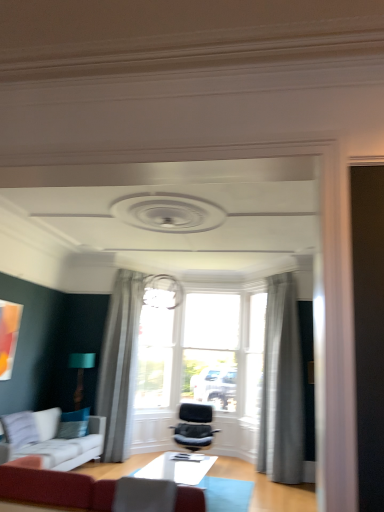
This screenshot has height=512, width=384. I want to click on velvet red sofa at lower left, the second studio couch from the left, so click(56, 489).

What is the approximate width of sheer gray curtain at upper center, the 2th curtain when ordered from left to right?

17.19 inches.

How much space does sheer gray curtain at upper center, arranged as the 1th curtain when viewed from the right, occupy vertically?

The height of sheer gray curtain at upper center, arranged as the 1th curtain when viewed from the right, is 9.73 feet.

Image resolution: width=384 pixels, height=512 pixels. Describe the element at coordinates (178, 468) in the screenshot. I see `white glossy table at center` at that location.

I want to click on gray sheer curtain at center, marked as the 1th curtain in a left-to-right arrangement, so click(x=120, y=364).

Identify the location of velvet red sofa at lower left, the second studio couch from the left. This screenshot has height=512, width=384. (56, 489).

Looking at this image, is teal fabric pillow at lower left shorter than velvet red sofa at lower left, the second studio couch from the left?

Correct, teal fabric pillow at lower left is not as tall as velvet red sofa at lower left, the second studio couch from the left.

From the image's perspective, which is above, teal fabric pillow at lower left or velvet red sofa at lower left, marked as the 1th studio couch in a right-to-left arrangement?

velvet red sofa at lower left, marked as the 1th studio couch in a right-to-left arrangement, is shown above in the image.

Can velvet red sofa at lower left, the second studio couch from the left, be found inside teal fabric pillow at lower left?

No, velvet red sofa at lower left, the second studio couch from the left, is located outside of teal fabric pillow at lower left.

Does teal fabric pillow at lower left lie in front of velvet red sofa at lower left, the second studio couch from the left?

No, it is behind velvet red sofa at lower left, the second studio couch from the left.

Would you say teal fabric pillow at lower left is part of gray sheer curtain at center, arranged as the 2th curtain when viewed from the right,'s contents?

No, teal fabric pillow at lower left is located outside of gray sheer curtain at center, arranged as the 2th curtain when viewed from the right.

From a real-world perspective, is gray sheer curtain at center, marked as the 1th curtain in a left-to-right arrangement, positioned above or below teal fabric pillow at lower left?

gray sheer curtain at center, marked as the 1th curtain in a left-to-right arrangement, is situated higher than teal fabric pillow at lower left in the real world.

Can velvet black chair at center be found inside white fabric couch at lower left, the second studio couch from the right?

No, white fabric couch at lower left, the second studio couch from the right, does not contain velvet black chair at center.

Is white fabric couch at lower left, the first studio couch in the back-to-front sequence, wider or thinner than velvet black chair at center?

Clearly, white fabric couch at lower left, the first studio couch in the back-to-front sequence, has less width compared to velvet black chair at center.

At what (x,y) coordinates should I click in order to perform the action: click on chair on the right of white fabric couch at lower left, marked as the 2th studio couch in a front-to-back arrangement. Please return your answer as a coordinate pair (x, y). The height and width of the screenshot is (512, 384). Looking at the image, I should click on (194, 426).

Is white fabric couch at lower left, the first studio couch in the back-to-front sequence, at the back of sheer gray curtain at upper center, the 2th curtain when ordered from left to right?

sheer gray curtain at upper center, the 2th curtain when ordered from left to right, is not turned away from white fabric couch at lower left, the first studio couch in the back-to-front sequence.

How different are the orientations of sheer gray curtain at upper center, the 2th curtain when ordered from left to right, and white fabric couch at lower left, the second studio couch from the right, in degrees?

The angular difference between sheer gray curtain at upper center, the 2th curtain when ordered from left to right, and white fabric couch at lower left, the second studio couch from the right, is 135 degrees.

Considering the sizes of sheer gray curtain at upper center, arranged as the 1th curtain when viewed from the right, and white fabric couch at lower left, the first studio couch in the back-to-front sequence, in the image, is sheer gray curtain at upper center, arranged as the 1th curtain when viewed from the right, bigger or smaller than white fabric couch at lower left, the first studio couch in the back-to-front sequence,?

sheer gray curtain at upper center, arranged as the 1th curtain when viewed from the right, is smaller than white fabric couch at lower left, the first studio couch in the back-to-front sequence.

How far apart are sheer gray curtain at upper center, the 2th curtain when ordered from left to right, and white fabric couch at lower left, marked as the 2th studio couch in a front-to-back arrangement?

sheer gray curtain at upper center, the 2th curtain when ordered from left to right, is 2.47 meters from white fabric couch at lower left, marked as the 2th studio couch in a front-to-back arrangement.

Is sheer gray curtain at upper center, the 2th curtain when ordered from left to right, directly adjacent to velvet red sofa at lower left, the second studio couch from the left?

They are not placed beside each other.

Is sheer gray curtain at upper center, arranged as the 1th curtain when viewed from the right, completely or partially outside of velvet red sofa at lower left, the second studio couch from the left?

Absolutely, sheer gray curtain at upper center, arranged as the 1th curtain when viewed from the right, is external to velvet red sofa at lower left, the second studio couch from the left.

Based on the photo, who is smaller, sheer gray curtain at upper center, the 2th curtain when ordered from left to right, or velvet red sofa at lower left, the second studio couch from the left?

velvet red sofa at lower left, the second studio couch from the left, is smaller.

Locate an element on the screen. The image size is (384, 512). pillow that is above the velvet black chair at center (from a real-world perspective) is located at coordinates (73, 424).

Would you say velvet black chair at center is outside teal fabric pillow at lower left?

velvet black chair at center lies outside teal fabric pillow at lower left's area.

Which of these two, velvet black chair at center or teal fabric pillow at lower left, is wider?

velvet black chair at center.

From a real-world perspective, which object rests below the other?

velvet black chair at center is physically lower.

Considering the relative sizes of gray sheer curtain at center, marked as the 1th curtain in a left-to-right arrangement, and sheer gray curtain at upper center, the 2th curtain when ordered from left to right, in the image provided, is gray sheer curtain at center, marked as the 1th curtain in a left-to-right arrangement, wider than sheer gray curtain at upper center, the 2th curtain when ordered from left to right,?

Correct, the width of gray sheer curtain at center, marked as the 1th curtain in a left-to-right arrangement, exceeds that of sheer gray curtain at upper center, the 2th curtain when ordered from left to right.

From the image's perspective, between gray sheer curtain at center, arranged as the 2th curtain when viewed from the right, and sheer gray curtain at upper center, the 2th curtain when ordered from left to right, who is located below?

sheer gray curtain at upper center, the 2th curtain when ordered from left to right, appears lower in the image.

Does gray sheer curtain at center, arranged as the 2th curtain when viewed from the right, have a greater height compared to sheer gray curtain at upper center, the 2th curtain when ordered from left to right?

Incorrect, the height of gray sheer curtain at center, arranged as the 2th curtain when viewed from the right, is not larger of that of sheer gray curtain at upper center, the 2th curtain when ordered from left to right.

Locate an element on the screen. studio couch located on the right of teal fabric pillow at lower left is located at coordinates (56, 489).

From the image's perspective, count 2nd curtains upward from the teal fabric pillow at lower left and point to it. Please provide its 2D coordinates.

[(120, 364)]

From the image, which object appears to be nearer to gray sheer curtain at center, marked as the 1th curtain in a left-to-right arrangement, white fabric couch at lower left, the first studio couch in the back-to-front sequence, or sheer gray curtain at upper center, the 2th curtain when ordered from left to right?

white fabric couch at lower left, the first studio couch in the back-to-front sequence.

From the image, which object appears to be farther from gray sheer curtain at center, arranged as the 2th curtain when viewed from the right, velvet red sofa at lower left, arranged as the 1th studio couch when viewed from the front, or sheer gray curtain at upper center, the 2th curtain when ordered from left to right?

velvet red sofa at lower left, arranged as the 1th studio couch when viewed from the front.

Based on the photo, from the image, which object appears to be nearer to sheer gray curtain at upper center, arranged as the 1th curtain when viewed from the right, gray sheer curtain at center, marked as the 1th curtain in a left-to-right arrangement, or white glossy table at center?

white glossy table at center is positioned closer to the anchor sheer gray curtain at upper center, arranged as the 1th curtain when viewed from the right.

Estimate the real-world distances between objects in this image. Which object is further from teal fabric lampshade at lower left, velvet black chair at center or gray sheer curtain at center, marked as the 1th curtain in a left-to-right arrangement?

Based on the image, velvet black chair at center appears to be further to teal fabric lampshade at lower left.

From the image, which object appears to be farther from velvet black chair at center, gray sheer curtain at center, marked as the 1th curtain in a left-to-right arrangement, or white glossy table at center?

gray sheer curtain at center, marked as the 1th curtain in a left-to-right arrangement, is further to velvet black chair at center.

Which object lies nearer to the anchor point teal fabric pillow at lower left, velvet red sofa at lower left, the second studio couch from the left, or white fabric couch at lower left, marked as the 2th studio couch in a front-to-back arrangement?

Based on the image, white fabric couch at lower left, marked as the 2th studio couch in a front-to-back arrangement, appears to be nearer to teal fabric pillow at lower left.

Considering their positions, is gray sheer curtain at center, arranged as the 2th curtain when viewed from the right, positioned further to white glossy table at center than teal fabric pillow at lower left?

teal fabric pillow at lower left is further to white glossy table at center.

Looking at the image, which one is located further to gray sheer curtain at center, marked as the 1th curtain in a left-to-right arrangement, velvet red sofa at lower left, the second studio couch from the left, or white glossy table at center?

Among the two, velvet red sofa at lower left, the second studio couch from the left, is located further to gray sheer curtain at center, marked as the 1th curtain in a left-to-right arrangement.

Locate an element on the screen. This screenshot has width=384, height=512. table between teal fabric pillow at lower left and sheer gray curtain at upper center, arranged as the 1th curtain when viewed from the right is located at coordinates (178, 468).

At what (x,y) coordinates should I click in order to perform the action: click on pillow situated between teal fabric lampshade at lower left and sheer gray curtain at upper center, arranged as the 1th curtain when viewed from the right, from left to right. Please return your answer as a coordinate pair (x, y). Looking at the image, I should click on (73, 424).

This screenshot has height=512, width=384. I want to click on curtain between teal fabric pillow at lower left and velvet black chair at center in the horizontal direction, so click(120, 364).

Where is `chair located between teal fabric pillow at lower left and sheer gray curtain at upper center, the 2th curtain when ordered from left to right, in the left-right direction`? This screenshot has height=512, width=384. chair located between teal fabric pillow at lower left and sheer gray curtain at upper center, the 2th curtain when ordered from left to right, in the left-right direction is located at coordinates (194, 426).